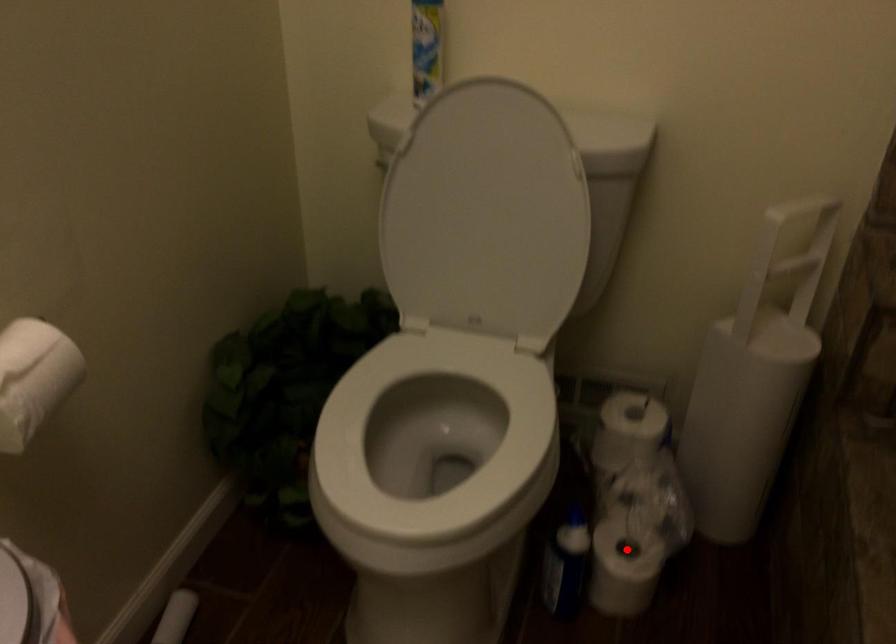
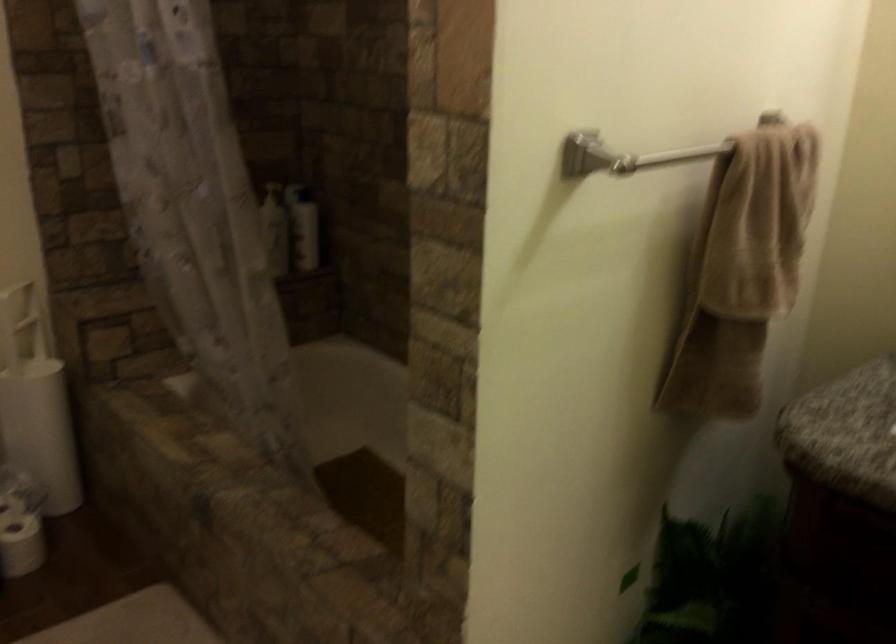
Question: I am providing you with two images of the same scene from different viewpoints. A red point is shown in image1. For the corresponding object point in image2, is it positioned nearer or farther from the camera?

Choices:
 (A) Nearer
 (B) Farther

Answer: (B)